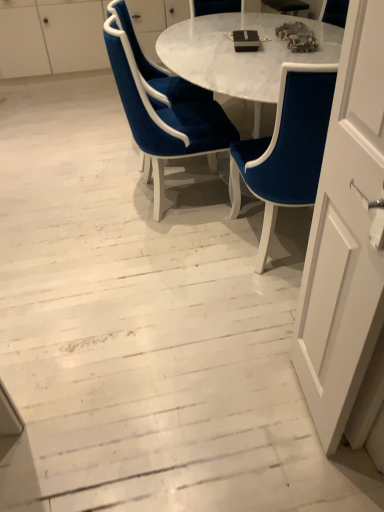
Find the location of `free spot in front of velvet blue chair at center, which appears as the 2th chair when viewed from the left`. free spot in front of velvet blue chair at center, which appears as the 2th chair when viewed from the left is located at coordinates (156, 249).